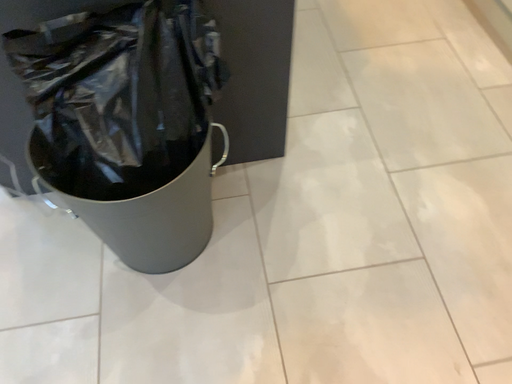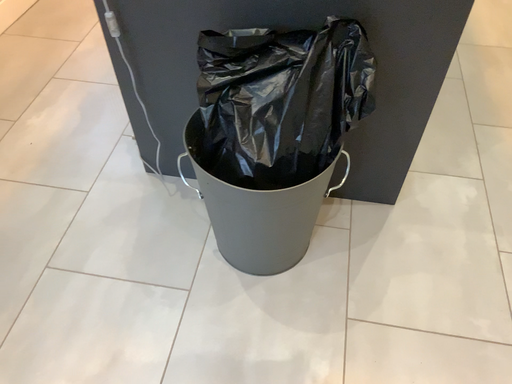
Question: How did the camera likely rotate when shooting the video?

Choices:
 (A) rotated downward
 (B) rotated upward

Answer: (B)